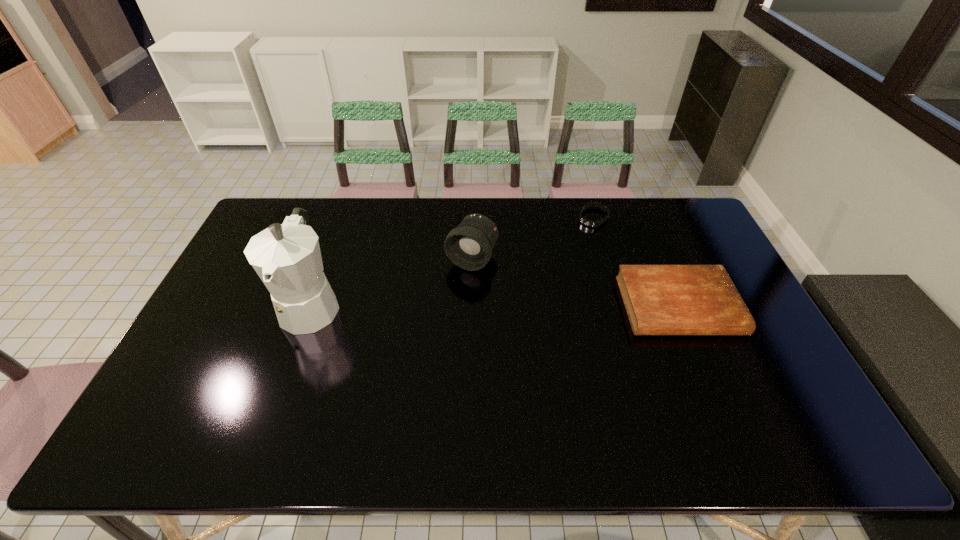
Where is `unoccupied area between the Bible and the telephoto lens`? This screenshot has width=960, height=540. unoccupied area between the Bible and the telephoto lens is located at coordinates pos(575,282).

The image size is (960, 540). What are the coordinates of `free space between the second tallest object and the farthest object` in the screenshot? It's located at (533, 238).

Image resolution: width=960 pixels, height=540 pixels. In order to click on object that can be found as the second closest to the shortest object in this screenshot , I will do `click(469, 246)`.

The width and height of the screenshot is (960, 540). I want to click on object that stands as the third closest to the second object from left to right, so click(x=659, y=299).